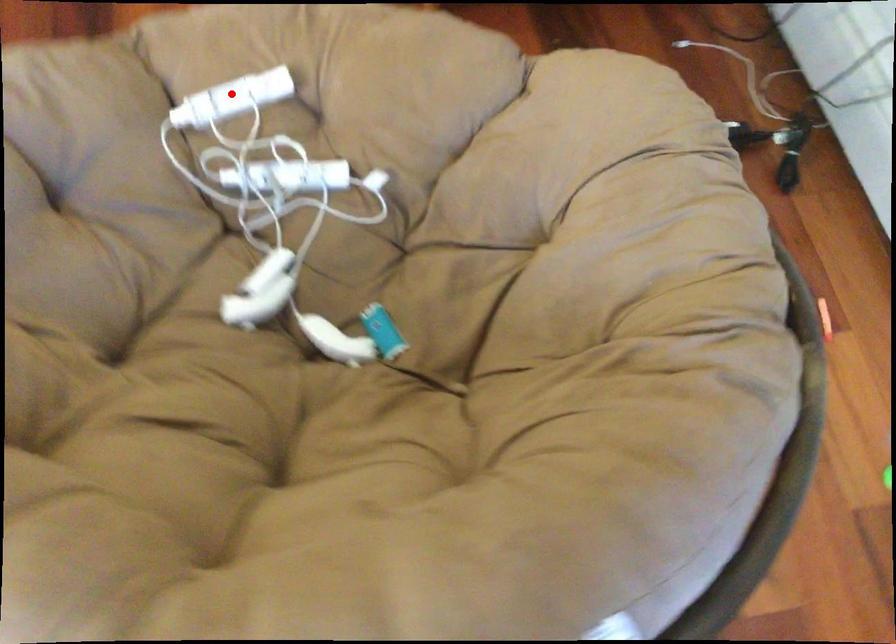
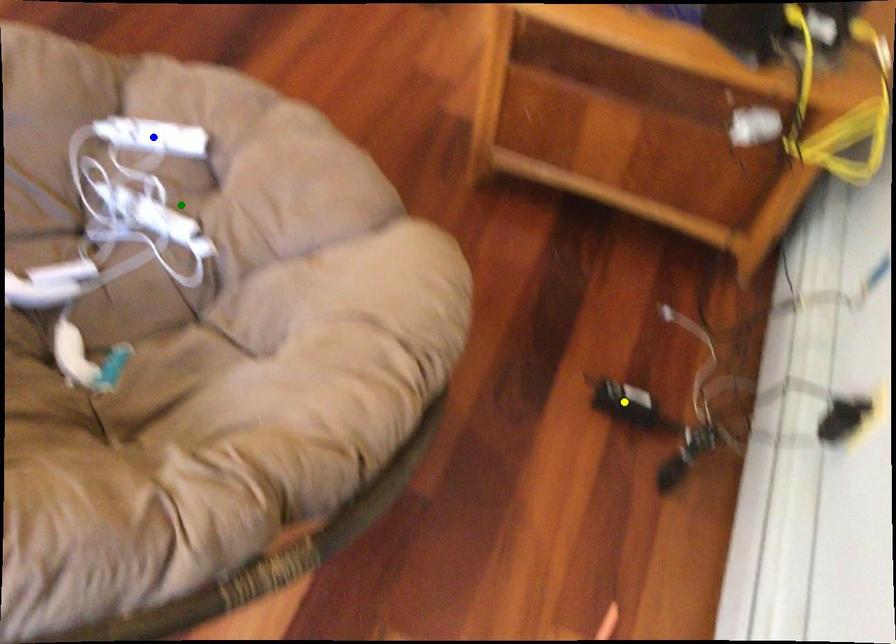
Question: I am providing you with two images of the same scene from different viewpoints. A red point is marked on the first image. You are given multiple points on the second image. Can you choose the point in image 2 that corresponds to the point in image 1?

Choices:
 (A) green point
 (B) yellow point
 (C) blue point

Answer: (C)